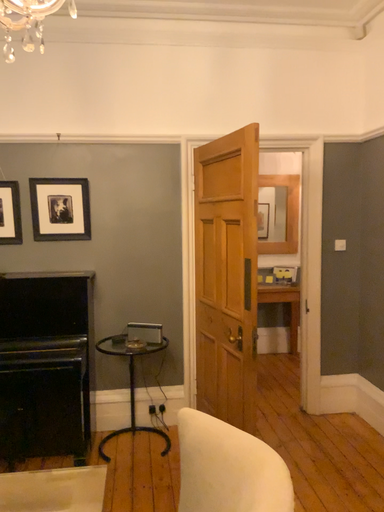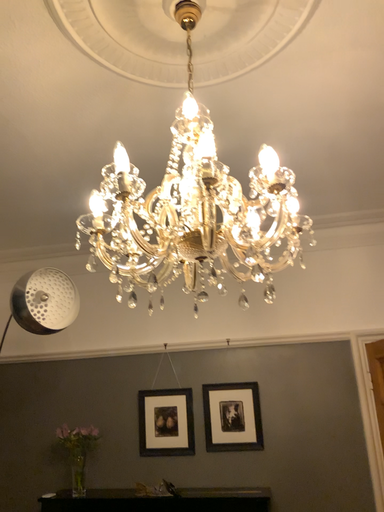
Question: Which way did the camera rotate in the video?

Choices:
 (A) rotated downward
 (B) rotated upward

Answer: (B)